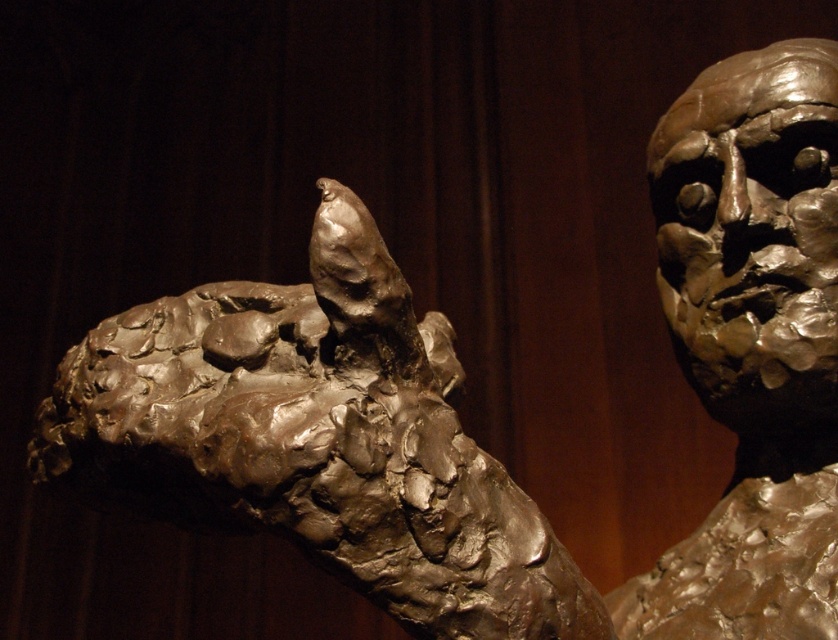
You are an art conservator working in a museum. You need to place a protective barrier between the matte bronze sculpture at center and the bronze textured bust at right to prevent accidental contact. Based on the current spacing, will the barrier, which is 12 inches wide, fit snugly between them without overlapping either artwork?

The matte bronze sculpture at center is 12.49 inches away from the bronze textured bust at right. Since the barrier is 12 inches wide, it will fit snugly between them with a small gap of 0.49 inches remaining.

You are an art conservator assessing the space needed to display both the matte bronze sculpture at center and the bronze textured bust at right. Based on their sizes, which one requires more horizontal space for proper display?

The matte bronze sculpture at center might require more horizontal space than the bronze textured bust at right since it is wider.

You are an art curator planning to display both the matte bronze sculpture at center and the bronze textured bust at right in a gallery. Given their sizes, which one should be placed on the larger pedestal to ensure proper proportion?

The matte bronze sculpture at center should be placed on the larger pedestal because it is bigger than the bronze textured bust at right.